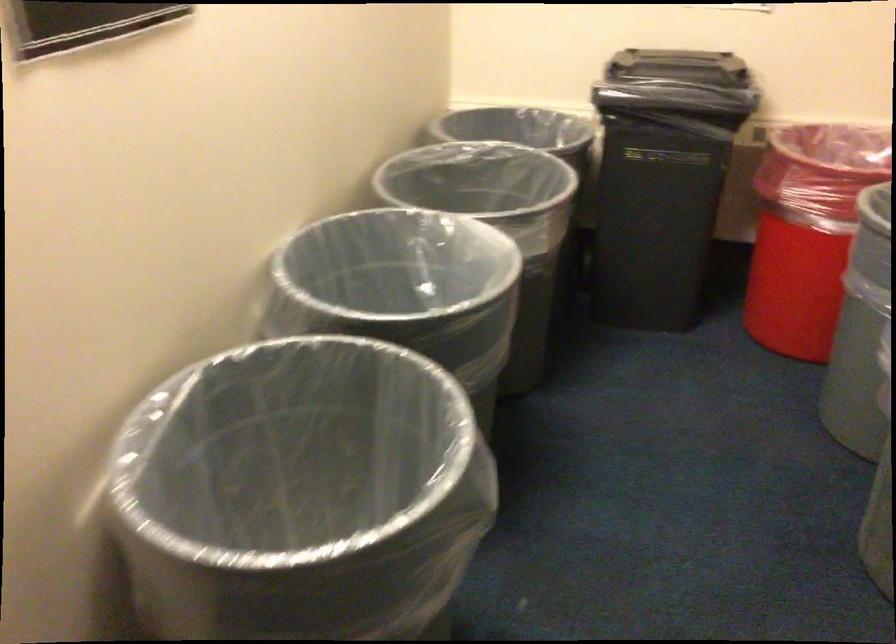
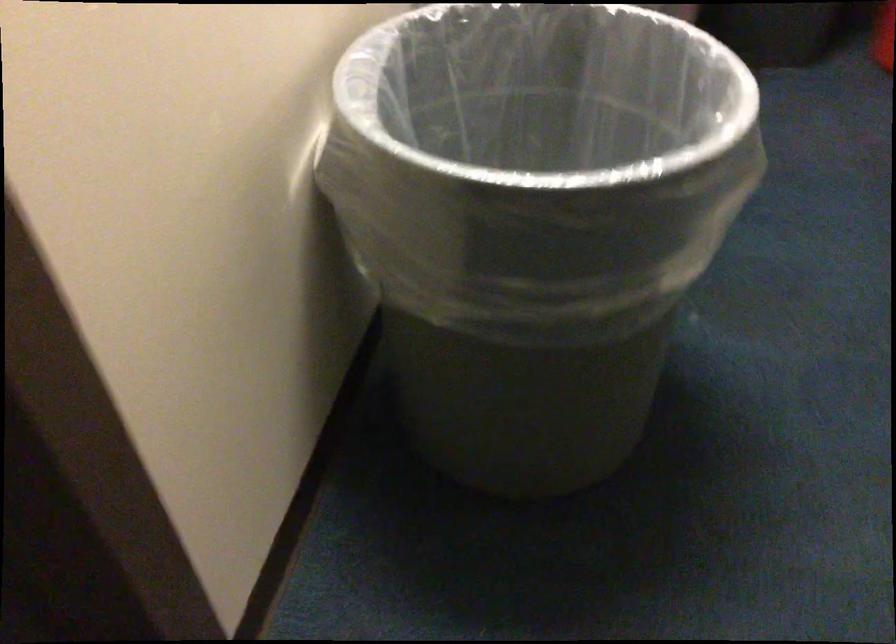
Question: The first image is from the beginning of the video and the second image is from the end. How did the camera likely rotate when shooting the video?

Choices:
 (A) Left
 (B) Right
 (C) Up
 (D) Down

Answer: (D)